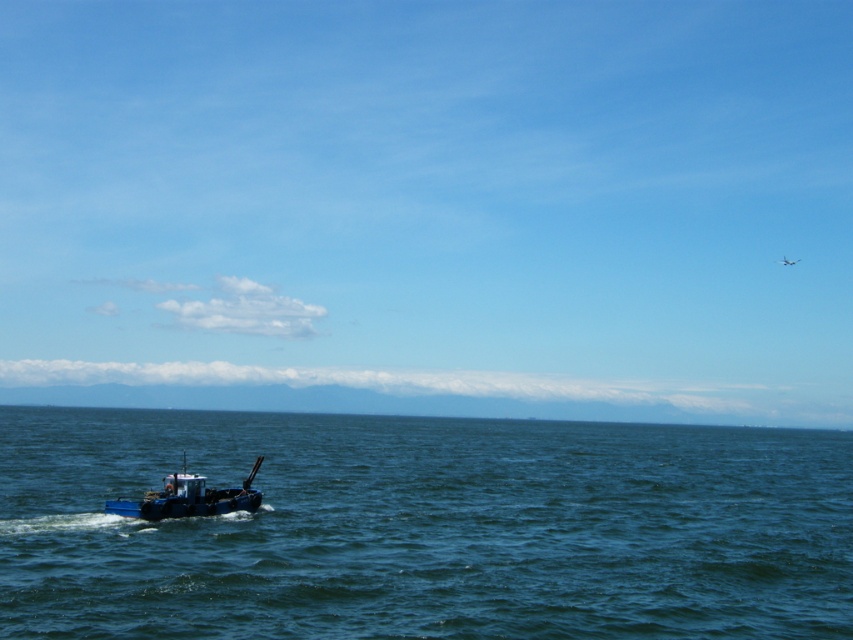
You are standing on the shore and see the dark blue water at lower left and the blue matte boat at lower left in the seascape. Which object is closer to you?

The dark blue water at lower left is closer to you because it is in front of the blue matte boat at lower left.

You are a photographer standing on the shore looking at the dark blue water at lower left and the blue matte boat at lower left. Which object appears taller in the photo?

The dark blue water at lower left appears taller than the blue matte boat at lower left in the photo.

You are standing on the deck of the small fishing boat in the lower left quadrant of the image and want to locate two points in the scene. The first point is at coordinates point (24, 435) and the second point is at coordinates point (125, 499). Which point is closer to you?

Point (24, 435) is closer to you than point (125, 499) because it is further to the viewer.